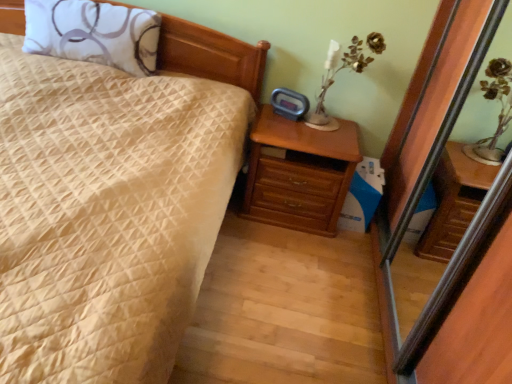
Question: From the image's perspective, is metallic gold flower at upper right above or below white printed pillow at upper left?

Choices:
 (A) above
 (B) below

Answer: (B)

Question: Looking at their shapes, would you say metallic gold flower at upper right is wider or thinner than white printed pillow at upper left?

Choices:
 (A) thin
 (B) wide

Answer: (A)

Question: Considering the real-world distances, which object is closest to the metallic gold flower at upper right?

Choices:
 (A) white printed pillow at upper left
 (B) beige quilted bed at center
 (C) wooden chest of drawers at right
 (D) transparent glass screen door at right

Answer: (C)

Question: Considering the real-world distances, which object is closest to the transparent glass screen door at right?

Choices:
 (A) beige quilted bed at center
 (B) white printed pillow at upper left
 (C) metallic gold flower at upper right
 (D) wooden chest of drawers at right

Answer: (D)